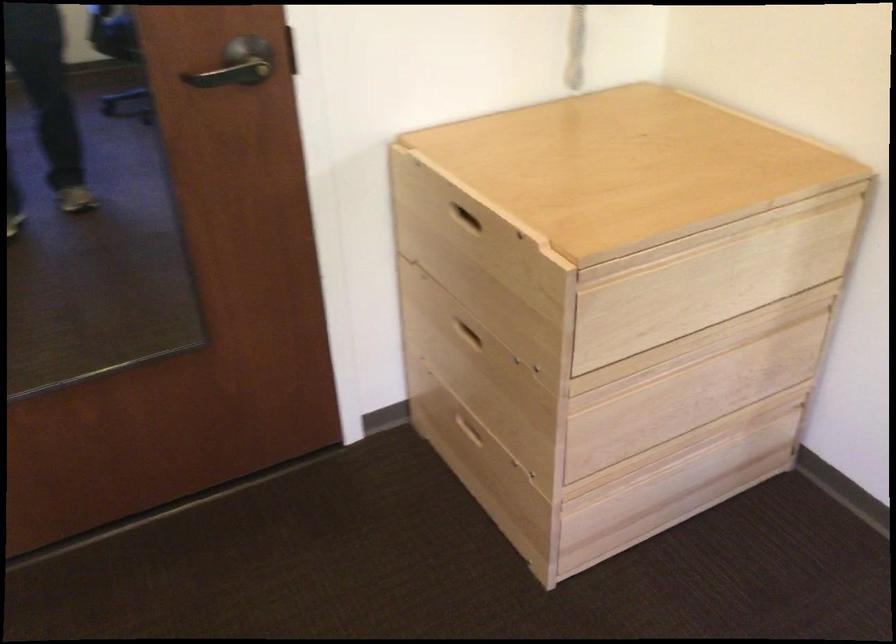
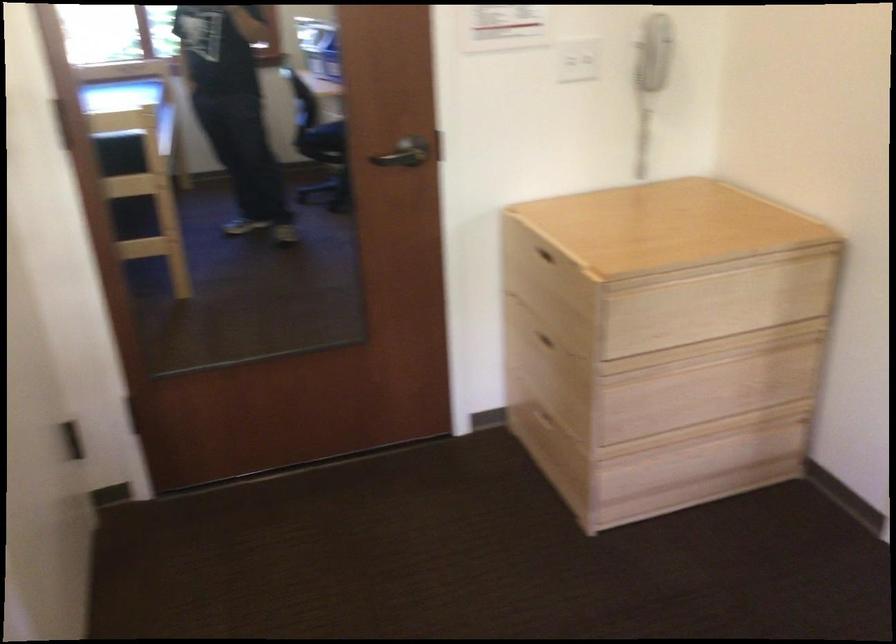
Question: In a continuous first-person perspective shot, in which direction is the camera moving?

Choices:
 (A) Left
 (B) Right
 (C) Forward
 (D) Backward

Answer: (D)